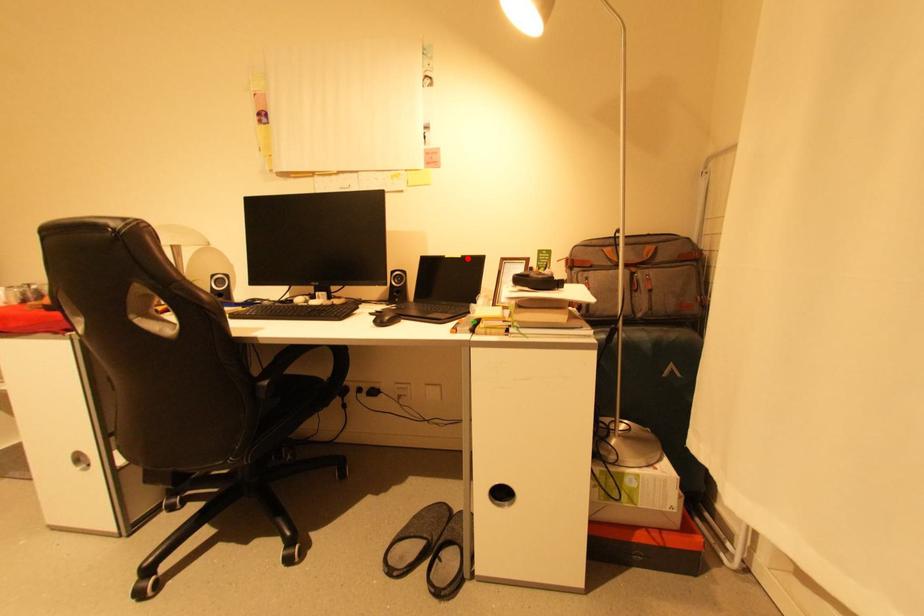
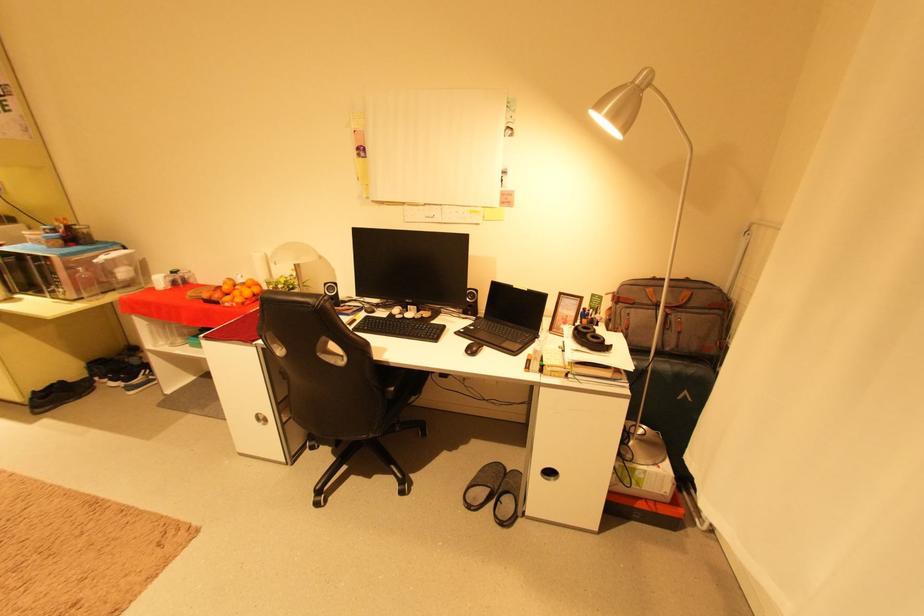
Find the pixel in the second image that matches the highlighted location in the first image.

(533, 291)